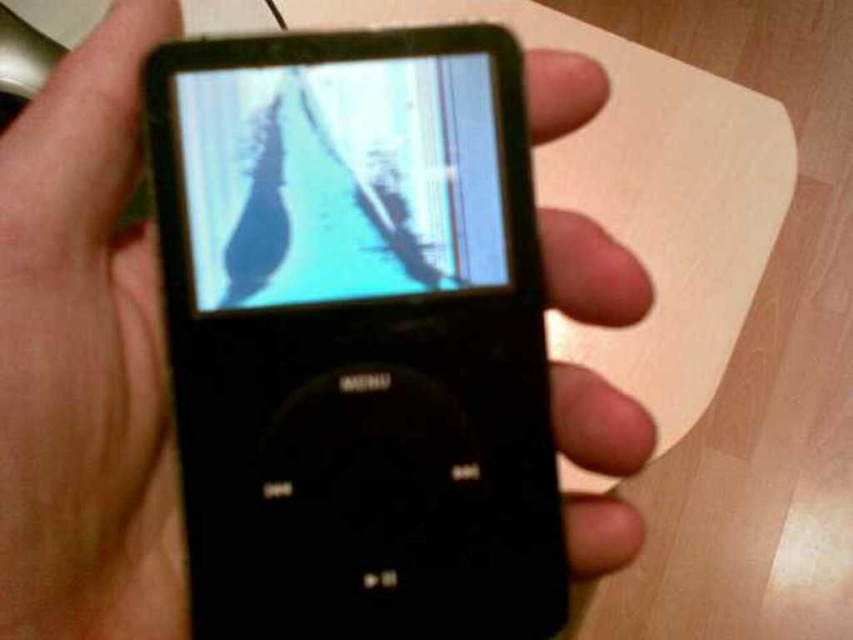
Which is above, black matte ipod at center or matte plastic screen at center?

Positioned higher is matte plastic screen at center.

Is black matte ipod at center positioned at the back of matte plastic screen at center?

That is False.

Where is `black matte ipod at center`? black matte ipod at center is located at coordinates (357, 336).